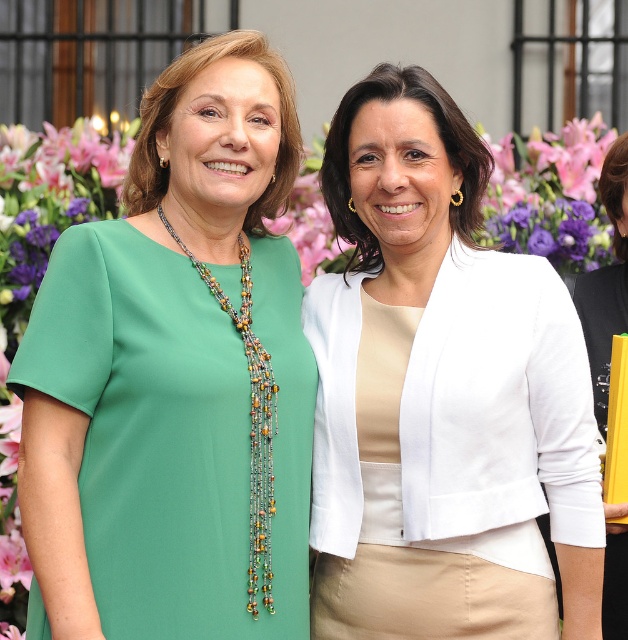
Is green satin dress at left positioned in front of white matte blazer at center?

Yes, it is in front of white matte blazer at center.

Does green satin dress at left have a greater width compared to white matte blazer at center?

A: No, green satin dress at left is not wider than white matte blazer at center.

The image size is (628, 640). Find the location of `green satin dress at left`. green satin dress at left is located at coordinates (175, 378).

Does green satin dress at left lie in front of multicolored beaded necklace at center?

Yes, green satin dress at left is closer to the viewer.

Which is in front, point (65, 525) or point (241, 280)?

Positioned in front is point (65, 525).

The width and height of the screenshot is (628, 640). Find the location of `green satin dress at left`. green satin dress at left is located at coordinates (175, 378).

Who is more forward, (x=617, y=227) or (x=241, y=244)?

Point (x=241, y=244) is more forward.

Can you confirm if white fabric dress at center is positioned below multicolored beaded necklace at center?

Incorrect, white fabric dress at center is not positioned below multicolored beaded necklace at center.

Identify the location of white fabric dress at center. Image resolution: width=628 pixels, height=640 pixels. (605, 282).